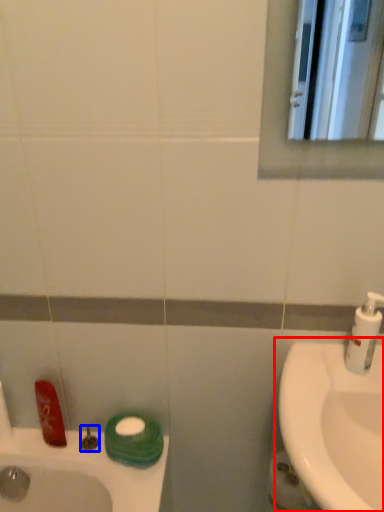
Question: Which object is closer to the camera taking this photo, sink (highlighted by a red box) or plumbing fixture (highlighted by a blue box)?

Choices:
 (A) sink
 (B) plumbing fixture

Answer: (A)